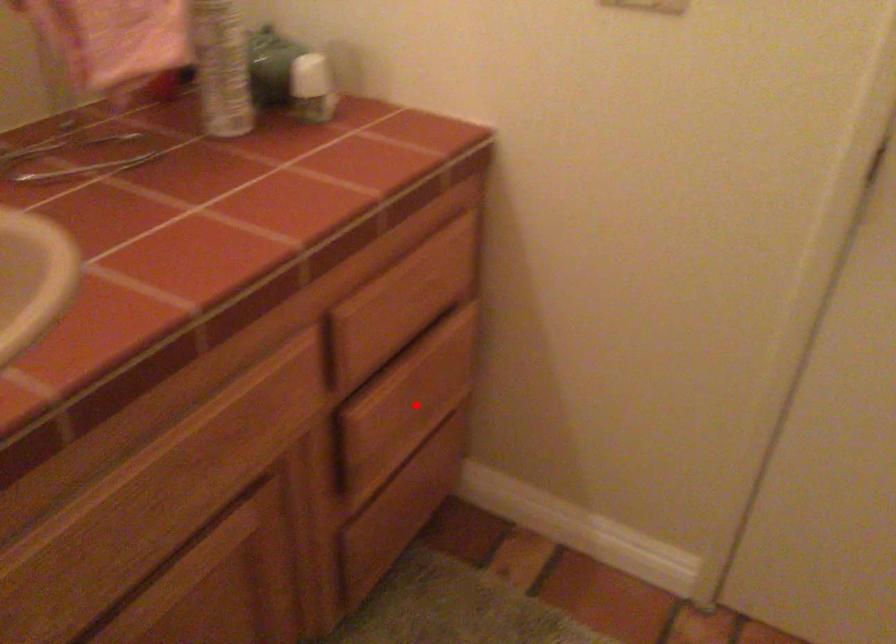
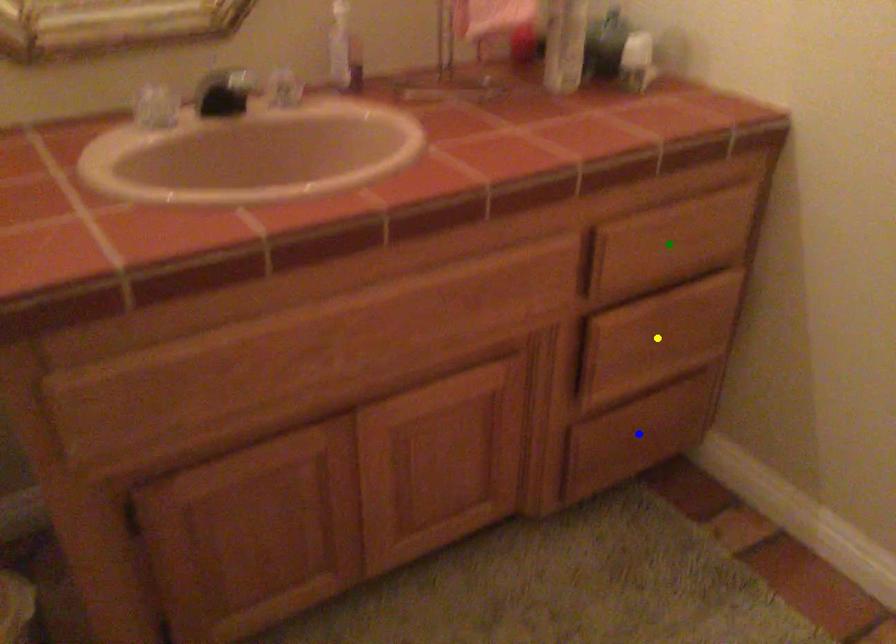
Question: I am providing you with two images of the same scene from different viewpoints. A red point is marked on the first image. You are given multiple points on the second image. Which mark in image 2 goes with the point in image 1?

Choices:
 (A) blue point
 (B) green point
 (C) yellow point

Answer: (C)